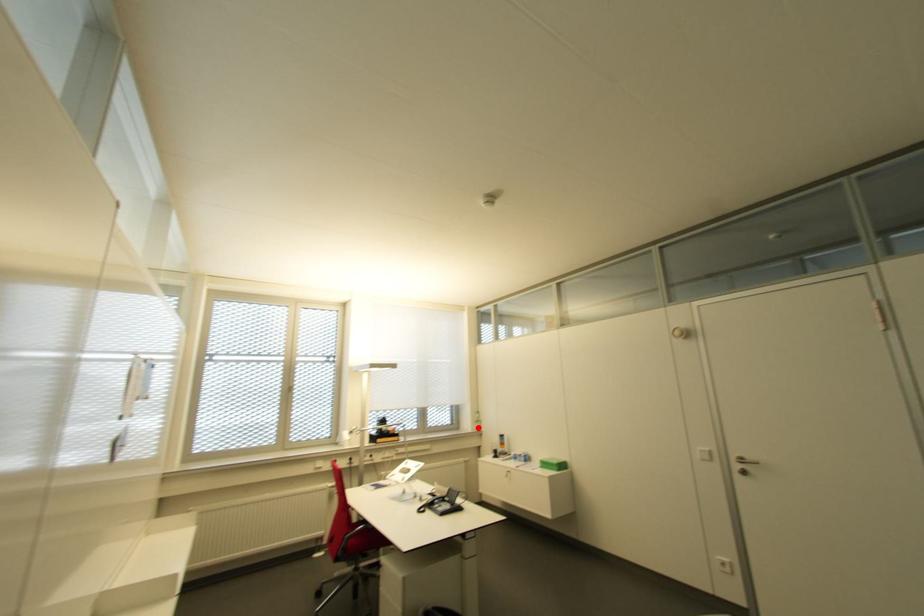
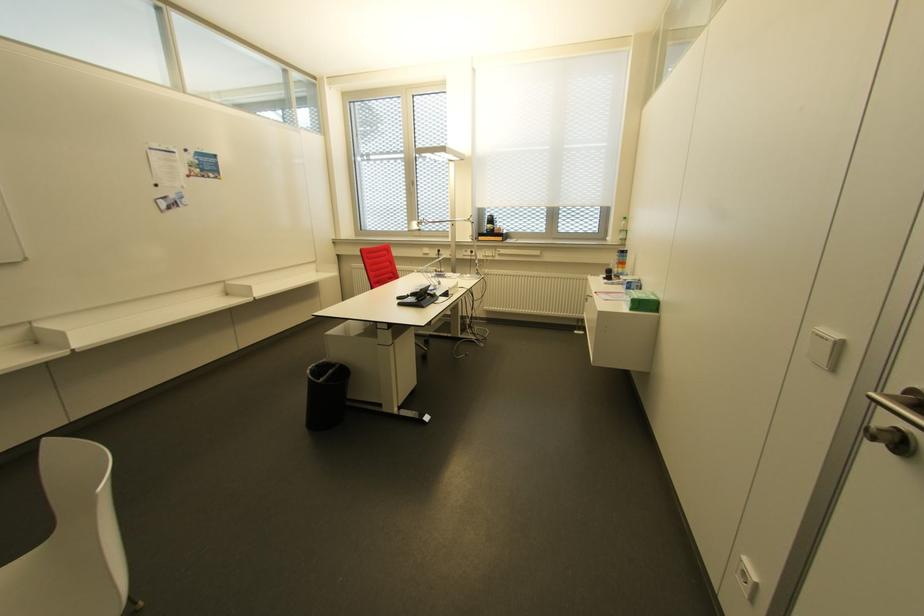
Question: I am providing you with two images of the same scene from different viewpoints. A red point is shown in image1. For the corresponding object point in image2, is it positioned nearer or farther from the camera?

Choices:
 (A) Nearer
 (B) Farther

Answer: (A)